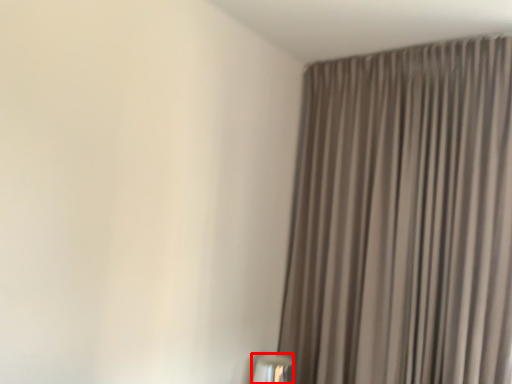
Question: From the image's perspective, where is table lamp (annotated by the red box) located in relation to curtain in the image?

Choices:
 (A) below
 (B) above

Answer: (A)